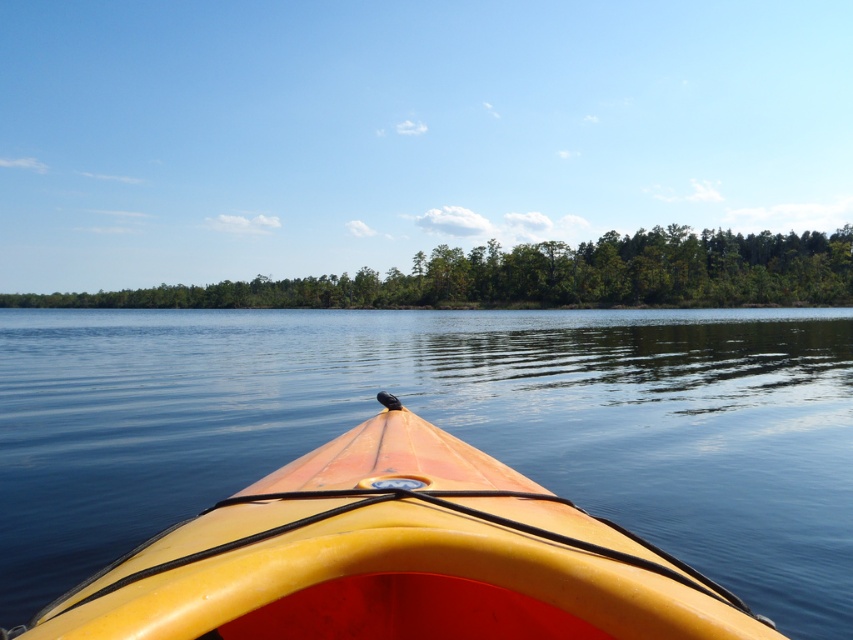
You are in a kayak and want to know if the green leafy trees at center are farther away from you than the yellow matte kayak at center. Based on the scene, what can you conclude?

The yellow matte kayak at center is closer to the viewer than the green leafy trees at center, so the green leafy trees at center are farther away from you than the yellow matte kayak at center.

You are in a kayak and want to know if you can see the green leafy trees at center from your current position in the yellow matte kayak at center. Can you see them?

The yellow matte kayak at center is located below the green leafy trees at center, so yes, you can see the green leafy trees at center from your position in the kayak as they are above you.

You are a drone operator trying to capture a photo of the yellow matte kayak at center from above. What coordinates should you aim for to ensure the kayak is centered in the photo?

The yellow matte kayak at center is located at coordinates point (395, 557), so you should aim for those coordinates to center the kayak in the photo.